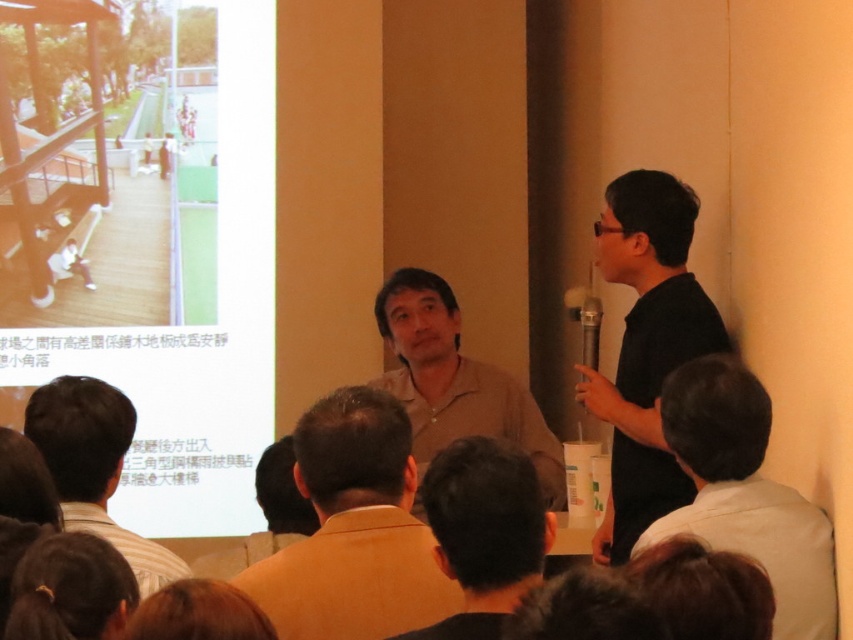
Question: Does black matte shirt at right appear on the left side of brown shirt at lower center?

Choices:
 (A) yes
 (B) no

Answer: (B)

Question: Among these objects, which one is nearest to the camera?

Choices:
 (A) brown shirt at lower center
 (B) dark brown hair at lower left
 (C) light brown shirt at center
 (D) black matte shirt at right

Answer: (B)

Question: Which point is farther to the camera?

Choices:
 (A) (33, 400)
 (B) (349, 387)
 (C) (471, 573)
 (D) (717, 545)

Answer: (A)

Question: Can you confirm if black matte shirt at right is wider than black matte shirt at center?

Choices:
 (A) no
 (B) yes

Answer: (B)

Question: Can you confirm if tan matte shirt at center is positioned to the left of black matte shirt at center?

Choices:
 (A) yes
 (B) no

Answer: (A)

Question: Which object is farther from the camera taking this photo?

Choices:
 (A) dark brown hair at lower left
 (B) white shirt at right
 (C) black matte shirt at center

Answer: (B)